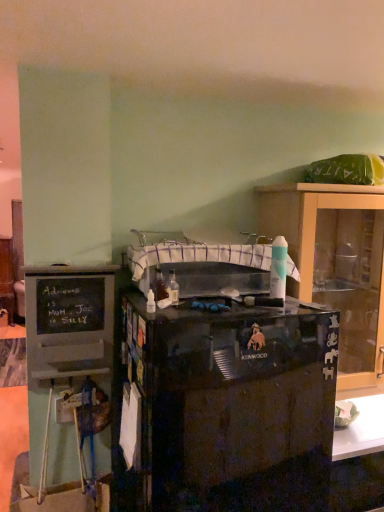
In order to face matte black kenwood mixer at right, which appears as the second cabinetry when viewed from the front, should I rotate leftwards or rightwards?

Rotate your view right by about 20.363°.

Locate an element on the screen. Image resolution: width=384 pixels, height=512 pixels. black chalkboard cabinet at left, marked as the 2th cabinetry in a back-to-front arrangement is located at coordinates tap(69, 321).

From a real-world perspective, does matte black kenwood mixer at right, which appears as the second cabinetry when viewed from the front, stand above black chalkboard cabinet at left, which is the first cabinetry in left-to-right order?

Yes, from a real-world perspective, matte black kenwood mixer at right, which appears as the second cabinetry when viewed from the front, is above black chalkboard cabinet at left, which is the first cabinetry in left-to-right order.

Are matte black kenwood mixer at right, the first cabinetry from the right, and black chalkboard cabinet at left, marked as the 2th cabinetry in a back-to-front arrangement, located far from each other?

Actually, matte black kenwood mixer at right, the first cabinetry from the right, and black chalkboard cabinet at left, marked as the 2th cabinetry in a back-to-front arrangement, are a little close together.

Could you tell me if matte black kenwood mixer at right, the first cabinetry from the right, is turned towards black chalkboard cabinet at left, marked as the 2th cabinetry in a back-to-front arrangement?

No, matte black kenwood mixer at right, the first cabinetry from the right, is not oriented towards black chalkboard cabinet at left, marked as the 2th cabinetry in a back-to-front arrangement.

Is black glossy kenwood mixer at center next to black chalkboard cabinet at left, which is the first cabinetry in left-to-right order, and touching it?

There is a gap between black glossy kenwood mixer at center and black chalkboard cabinet at left, which is the first cabinetry in left-to-right order.

Considering the points (328, 316) and (86, 284), which point is behind, point (328, 316) or point (86, 284)?

The point (86, 284) is behind.

Is black chalkboard cabinet at left, which is the 1th cabinetry from front to back, surrounded by black glossy kenwood mixer at center?

Actually, black chalkboard cabinet at left, which is the 1th cabinetry from front to back, is outside black glossy kenwood mixer at center.

From the image's perspective, between black glossy kenwood mixer at center and black chalkboard cabinet at left, the second cabinetry from the right, who is located below?

black glossy kenwood mixer at center, from the image's perspective.

From a real-world perspective, between white fabric sink at center and black glossy kenwood mixer at center, who is vertically higher?

In real-world perspective, white fabric sink at center is above.

I want to click on desk in front of the white fabric sink at center, so click(229, 407).

Which of these two, white fabric sink at center or black glossy kenwood mixer at center, is smaller?

Smaller between the two is white fabric sink at center.

Is white fabric sink at center outside of black glossy kenwood mixer at center?

That's correct, white fabric sink at center is outside of black glossy kenwood mixer at center.

Where is `cabinetry on the left side of white fabric sink at center`? This screenshot has width=384, height=512. cabinetry on the left side of white fabric sink at center is located at coordinates (69, 321).

Which is correct: black chalkboard cabinet at left, which is the 1th cabinetry from front to back, is inside white fabric sink at center, or outside of it?

The correct answer is: outside.

Is black chalkboard cabinet at left, which is the 1th cabinetry from front to back, beside white fabric sink at center?

black chalkboard cabinet at left, which is the 1th cabinetry from front to back, and white fabric sink at center are clearly separated.

How different are the orientations of black chalkboard cabinet at left, which is the first cabinetry in left-to-right order, and white fabric sink at center in degrees?

There is a 0.0874-degree angle between the facing directions of black chalkboard cabinet at left, which is the first cabinetry in left-to-right order, and white fabric sink at center.

Between point (277, 216) and point (174, 438), which one is positioned in front?

Point (174, 438)

There is a black glossy kenwood mixer at center. Where is `the 2nd cabinetry above it (from a real-world perspective)`? The height and width of the screenshot is (512, 384). the 2nd cabinetry above it (from a real-world perspective) is located at coordinates (332, 260).

Is matte black kenwood mixer at right, the 2th cabinetry from the left, oriented away from black glossy kenwood mixer at center?

No, matte black kenwood mixer at right, the 2th cabinetry from the left, is not facing away from black glossy kenwood mixer at center.

What's the angular difference between matte black kenwood mixer at right, the 2th cabinetry from the left, and black glossy kenwood mixer at center's facing directions?

0.000167 degrees.

Who is more distant, black glossy kenwood mixer at center or white fabric sink at center?

Positioned behind is white fabric sink at center.

How many degrees apart are the facing directions of black glossy kenwood mixer at center and white fabric sink at center?

The angular difference between black glossy kenwood mixer at center and white fabric sink at center is 0.000346 degrees.

Is black glossy kenwood mixer at center at the left side of white fabric sink at center?

In fact, black glossy kenwood mixer at center is to the right of white fabric sink at center.

There is a matte black kenwood mixer at right, which appears as the second cabinetry when viewed from the front. At what (x,y) coordinates should I click in order to perform the action: click on sink above it (from a real-world perspective). Please return your answer as a coordinate pair (x, y). This screenshot has width=384, height=512. Looking at the image, I should click on (194, 255).

From a real-world perspective, is white fabric sink at center under matte black kenwood mixer at right, which is the 1th cabinetry from back to front?

No.

From the picture: Would you say matte black kenwood mixer at right, which is the 1th cabinetry from back to front, is part of white fabric sink at center's contents?

No, matte black kenwood mixer at right, which is the 1th cabinetry from back to front, is located outside of white fabric sink at center.

Considering the positions of objects white fabric sink at center and matte black kenwood mixer at right, which is the 1th cabinetry from back to front, in the image provided, who is more to the left, white fabric sink at center or matte black kenwood mixer at right, which is the 1th cabinetry from back to front,?

From the viewer's perspective, white fabric sink at center appears more on the left side.

Locate an element on the screen. This screenshot has height=512, width=384. cabinetry lying on the right of black chalkboard cabinet at left, the second cabinetry from the right is located at coordinates (332, 260).

At what (x,y) coordinates should I click in order to perform the action: click on the 1st cabinetry positioned above the black glossy kenwood mixer at center (from the image's perspective). Please return your answer as a coordinate pair (x, y). The width and height of the screenshot is (384, 512). Looking at the image, I should click on (69, 321).

When comparing their distances from black glossy kenwood mixer at center, does white fabric sink at center or matte black kenwood mixer at right, the 2th cabinetry from the left, seem further?

Based on the image, matte black kenwood mixer at right, the 2th cabinetry from the left, appears to be further to black glossy kenwood mixer at center.

Looking at the image, which one is located closer to white fabric sink at center, black glossy kenwood mixer at center or black chalkboard cabinet at left, the second cabinetry from the right?

Based on the image, black chalkboard cabinet at left, the second cabinetry from the right, appears to be nearer to white fabric sink at center.

Which object lies further to the anchor point black glossy kenwood mixer at center, white fabric sink at center or black chalkboard cabinet at left, which is the 1th cabinetry from front to back?

black chalkboard cabinet at left, which is the 1th cabinetry from front to back, is positioned further to the anchor black glossy kenwood mixer at center.

Considering their positions, is white fabric sink at center positioned further to matte black kenwood mixer at right, which is the 1th cabinetry from back to front, than black glossy kenwood mixer at center?

black glossy kenwood mixer at center is positioned further to the anchor matte black kenwood mixer at right, which is the 1th cabinetry from back to front.

From the image, which object appears to be nearer to black glossy kenwood mixer at center, black chalkboard cabinet at left, which is the first cabinetry in left-to-right order, or matte black kenwood mixer at right, which is the 1th cabinetry from back to front?

Among the two, black chalkboard cabinet at left, which is the first cabinetry in left-to-right order, is located nearer to black glossy kenwood mixer at center.

Considering their positions, is matte black kenwood mixer at right, which appears as the second cabinetry when viewed from the front, positioned closer to black glossy kenwood mixer at center than black chalkboard cabinet at left, the second cabinetry from the right?

black chalkboard cabinet at left, the second cabinetry from the right, lies closer to black glossy kenwood mixer at center than the other object.

Considering their positions, is white fabric sink at center positioned closer to matte black kenwood mixer at right, which is the 1th cabinetry from back to front, than black chalkboard cabinet at left, marked as the 2th cabinetry in a back-to-front arrangement?

white fabric sink at center lies closer to matte black kenwood mixer at right, which is the 1th cabinetry from back to front, than the other object.

Based on the photo, from the image, which object appears to be nearer to white fabric sink at center, matte black kenwood mixer at right, which appears as the second cabinetry when viewed from the front, or black glossy kenwood mixer at center?

Among the two, matte black kenwood mixer at right, which appears as the second cabinetry when viewed from the front, is located nearer to white fabric sink at center.

Locate an element on the screen. This screenshot has height=512, width=384. desk located between black chalkboard cabinet at left, which is the 1th cabinetry from front to back, and matte black kenwood mixer at right, the 2th cabinetry from the left, in the left-right direction is located at coordinates (229, 407).

Locate an element on the screen. The height and width of the screenshot is (512, 384). sink situated between black chalkboard cabinet at left, the second cabinetry from the right, and matte black kenwood mixer at right, the first cabinetry from the right, from left to right is located at coordinates (194, 255).

Where is `desk between white fabric sink at center and matte black kenwood mixer at right, the 2th cabinetry from the left`? The height and width of the screenshot is (512, 384). desk between white fabric sink at center and matte black kenwood mixer at right, the 2th cabinetry from the left is located at coordinates (229, 407).